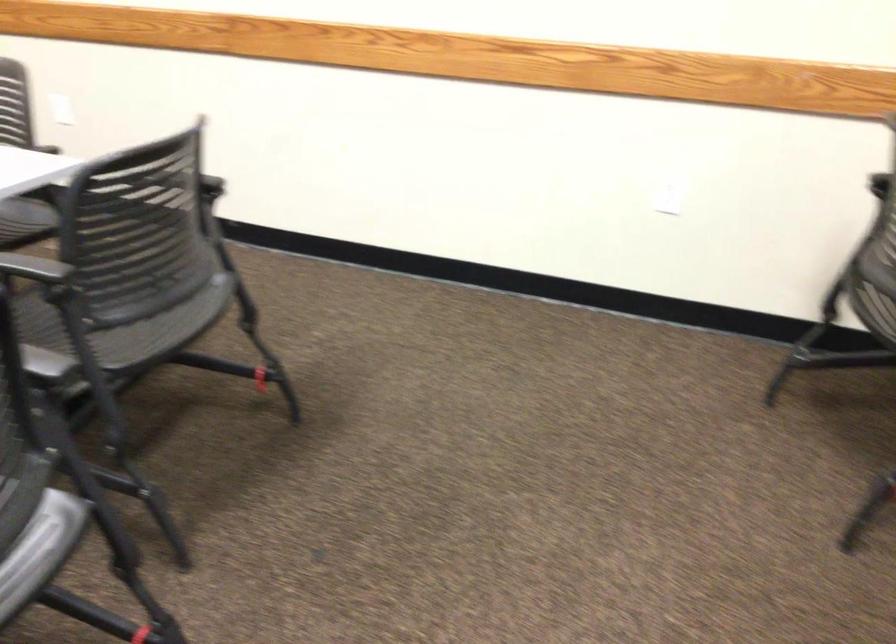
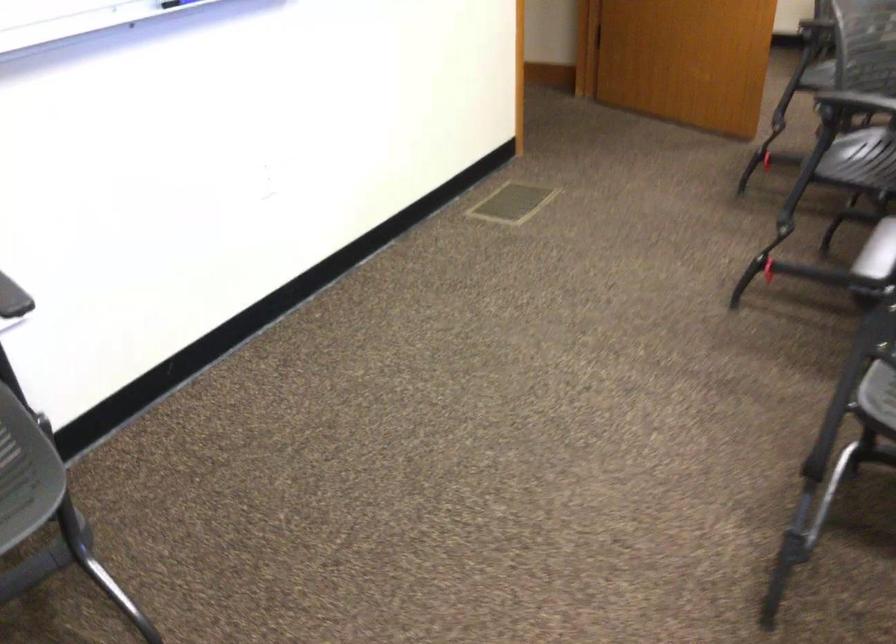
Based on the continuous images, in which direction is the camera rotating?

The rotation direction of the camera is left-down.